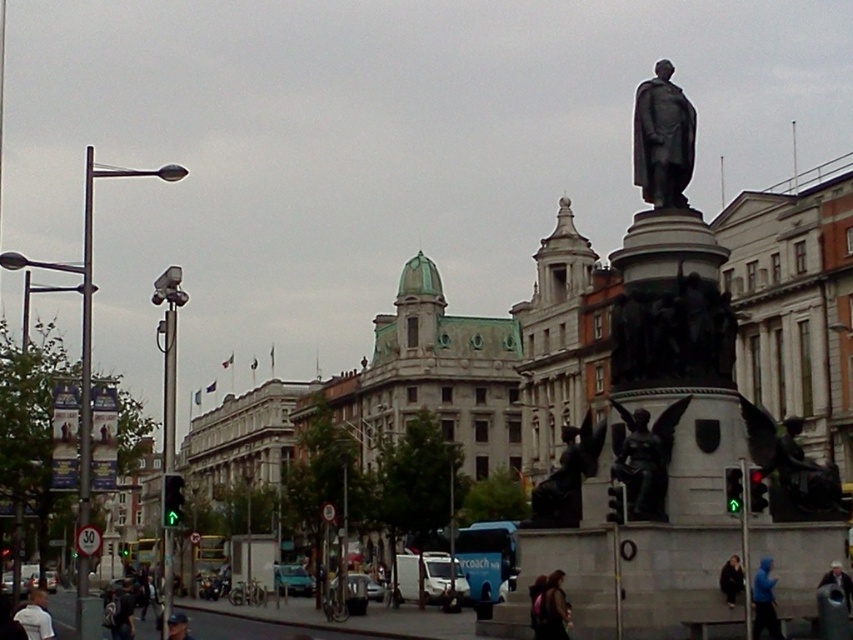
Is polished bronze angel at center positioned before light brown hair at lower left?

No, it is behind light brown hair at lower left.

Is point (634, 433) closer to viewer compared to point (28, 621)?

No, (634, 433) is behind (28, 621).

What do you see at coordinates (645, 458) in the screenshot?
I see `polished bronze angel at center` at bounding box center [645, 458].

Locate an element on the screen. polished bronze angel at center is located at coordinates (645, 458).

Based on the photo, between light brown hair at lower left and dark blue baseball cap at lower left, which one appears on the left side from the viewer's perspective?

From the viewer's perspective, light brown hair at lower left appears more on the left side.

Which is below, light brown hair at lower left or dark blue baseball cap at lower left?

light brown hair at lower left is below.

Which is in front, point (16, 611) or point (167, 625)?

Point (167, 625)

You are a GUI agent. You are given a task and a screenshot of the screen. Output one action in this format:
    pyautogui.click(x=<x>, y=<y>)
    Task: Click on the light brown hair at lower left
    
    Given the screenshot: What is the action you would take?
    pyautogui.click(x=35, y=616)

Which is more to the left, bronze statue at upper right or blue hooded jacket at lower right?

bronze statue at upper right

Who is more distant from viewer, (660, 99) or (772, 628)?

The point (660, 99) is more distant.

Who is more distant from viewer, (641, 81) or (753, 602)?

Point (641, 81)

This screenshot has width=853, height=640. I want to click on bronze statue at upper right, so click(x=662, y=140).